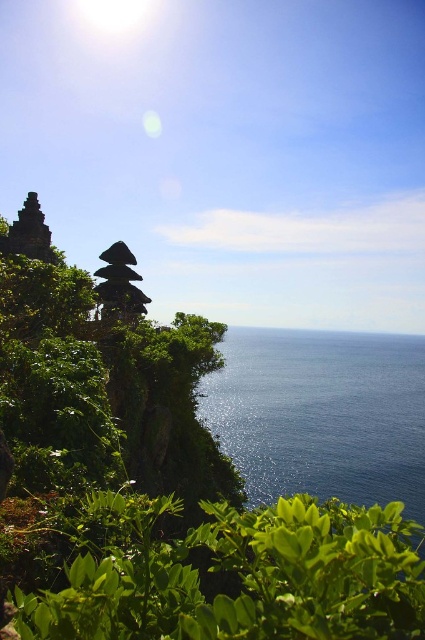
You are standing at the base of the cliff where the temple is located. You want to reach the blue glossy water at lower center. According to the coordinates provided, in which cardinal direction should you head from the temple to reach the water?

The blue glossy water at lower center is located at coordinates point (322, 413). Since the temple is on the left side of the image, heading towards the right direction would lead you towards the water.

Based on the photo, you are a tourist standing on the beach and want to take a photo of both the blue glossy water at lower center and the dark brown stone structure at center. Given that your camera has a maximum zoom range of 50 meters, can you capture both objects in a single frame without moving your position?

The blue glossy water at lower center is 83.70 meters away from the dark brown stone structure at center. Since the distance between them exceeds the camera maximum zoom range of 50 meters, you cannot capture both objects in a single frame without moving your position.

You are a photographer planning to capture the dark brown stone structure at center and the blue glossy water at lower center in a single frame. Based on their positions, which object should you focus on first to ensure both are in the shot?

The dark brown stone structure at center is above the blue glossy water at lower center, so focusing on the structure first will allow the water to naturally fall into the lower portion of the frame.